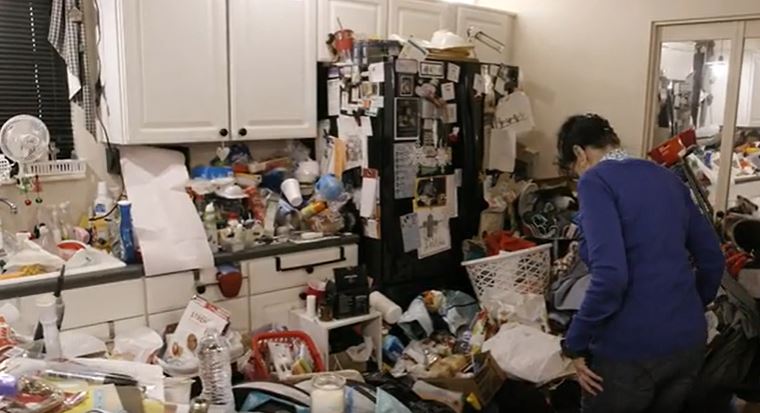
The image size is (760, 413). What are the coordinates of `window` in the screenshot? It's located at (701, 76), (746, 118).